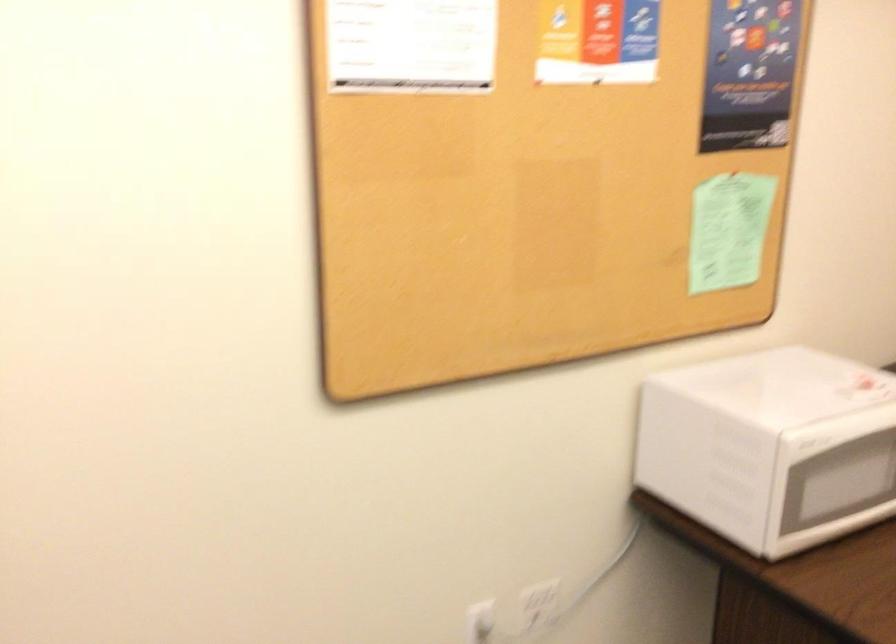
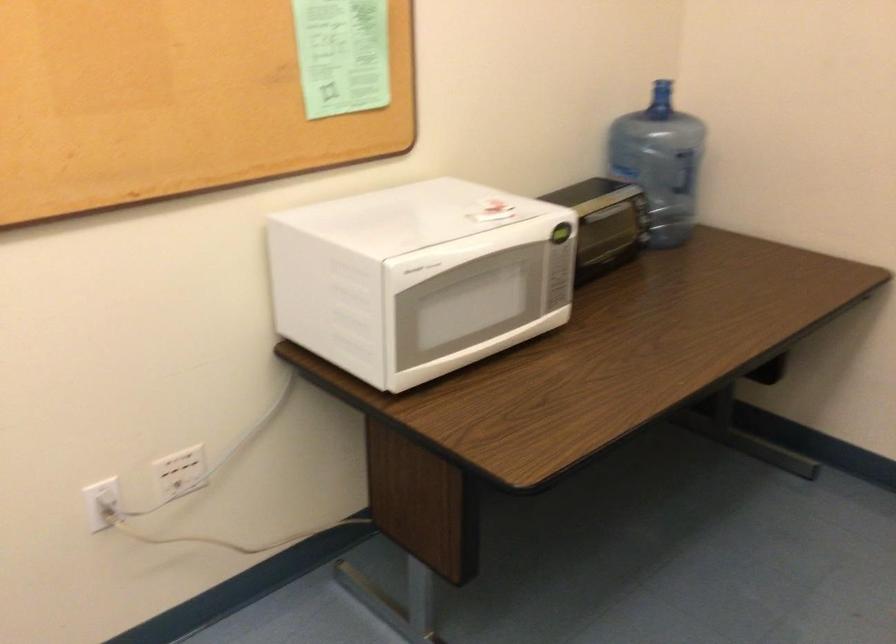
Question: The first image is from the beginning of the video and the second image is from the end. How did the camera likely rotate when shooting the video?

Choices:
 (A) Left
 (B) Right
 (C) Up
 (D) Down

Answer: (B)